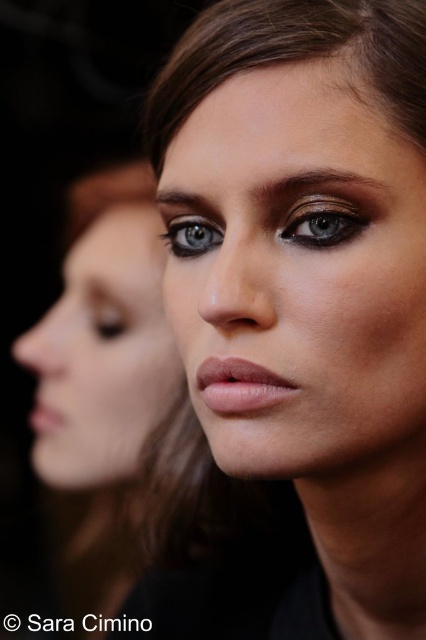
Question: Does matte pink lips at center appear on the left side of matte brown eye at center?

Choices:
 (A) no
 (B) yes

Answer: (B)

Question: Which point is farther to the camera?

Choices:
 (A) dark brown eyebrow at upper center
 (B) brown smooth hair at upper center

Answer: (A)

Question: Which object is farther from the camera taking this photo?

Choices:
 (A) matte pink lipstick at lower left
 (B) brown smooth hair at upper center

Answer: (A)

Question: Does matte pink lips at center appear over matte green eye at center?

Choices:
 (A) yes
 (B) no

Answer: (B)

Question: Is brown smooth hair at upper center above matte green eye at center?

Choices:
 (A) yes
 (B) no

Answer: (A)

Question: Which of these objects is positioned closest to the matte pink lips at center?

Choices:
 (A) matte skin face at center
 (B) brown smooth hair at upper center
 (C) matte pink lipstick at lower left
 (D) smooth skin face at center

Answer: (D)